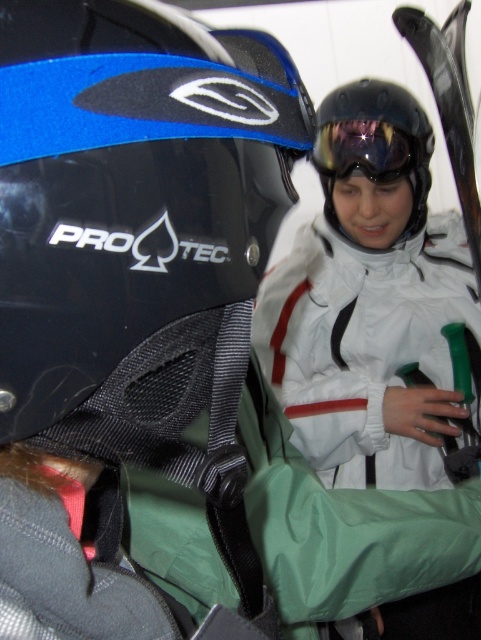
Can you confirm if glossy black helmet at upper center is wider than glossy black goggles at center?

Correct, the width of glossy black helmet at upper center exceeds that of glossy black goggles at center.

Can you confirm if glossy black helmet at upper center is thinner than glossy black goggles at center?

No, glossy black helmet at upper center is not thinner than glossy black goggles at center.

Does point (371, 97) come in front of point (392, 144)?

No.

Locate an element on the screen. This screenshot has width=481, height=640. glossy black helmet at upper center is located at coordinates (374, 145).

Is black matte helmet at left bigger than white matte jacket at center?

Actually, black matte helmet at left might be smaller than white matte jacket at center.

Is black matte helmet at left above white matte jacket at center?

No.

Is point (278, 99) positioned after point (374, 106)?

No, it is in front of (374, 106).

Locate an element on the screen. black matte helmet at left is located at coordinates (130, 189).

Is white matte jacket at center closer to the viewer compared to glossy black goggles at center?

Yes.

Is white matte jacket at center to the right of glossy black goggles at center from the viewer's perspective?

Yes, white matte jacket at center is to the right of glossy black goggles at center.

Which is behind, point (317, 340) or point (405, 161)?

Point (317, 340)

Image resolution: width=481 pixels, height=640 pixels. Identify the location of white matte jacket at center. (368, 300).